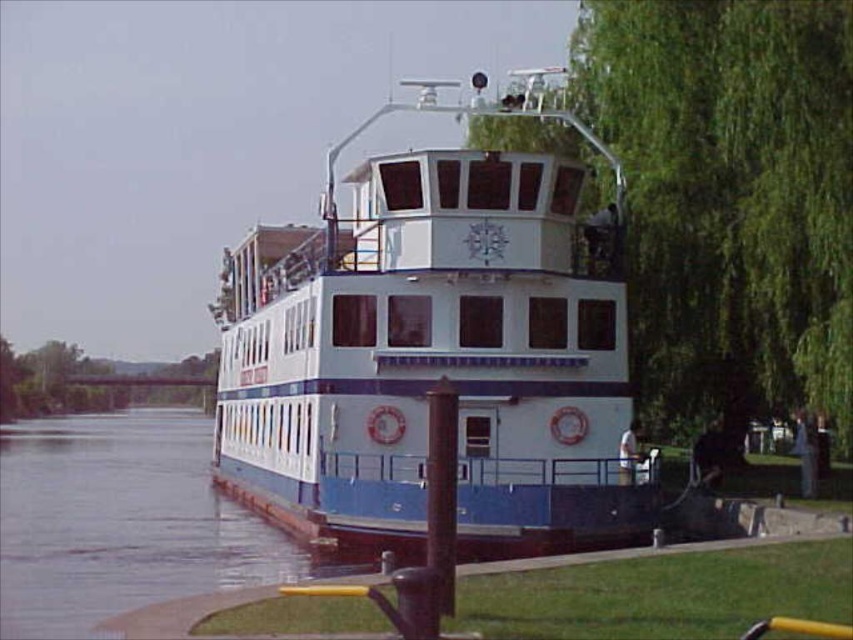
Is white glossy boat at center wider than blue glossy water at lower left?

Correct, the width of white glossy boat at center exceeds that of blue glossy water at lower left.

Can you confirm if white glossy boat at center is positioned to the right of blue glossy water at lower left?

Yes, white glossy boat at center is to the right of blue glossy water at lower left.

Between point (328, 195) and point (209, 444), which one is positioned in front?

Positioned in front is point (328, 195).

Locate an element on the screen. Image resolution: width=853 pixels, height=640 pixels. white glossy boat at center is located at coordinates (431, 352).

Which is above, white glossy boat at center or green leafy tree at right?

Positioned higher is white glossy boat at center.

Does point (573, 472) come behind point (721, 243)?

No.

Locate an element on the screen. white glossy boat at center is located at coordinates (431, 352).

Is green leafy tree at right taller than blue glossy water at lower left?

Yes.

Between green leafy tree at right and blue glossy water at lower left, which one is positioned higher?

green leafy tree at right is higher up.

The width and height of the screenshot is (853, 640). Identify the location of green leafy tree at right. (730, 195).

Identify the location of green leafy tree at right. (730, 195).